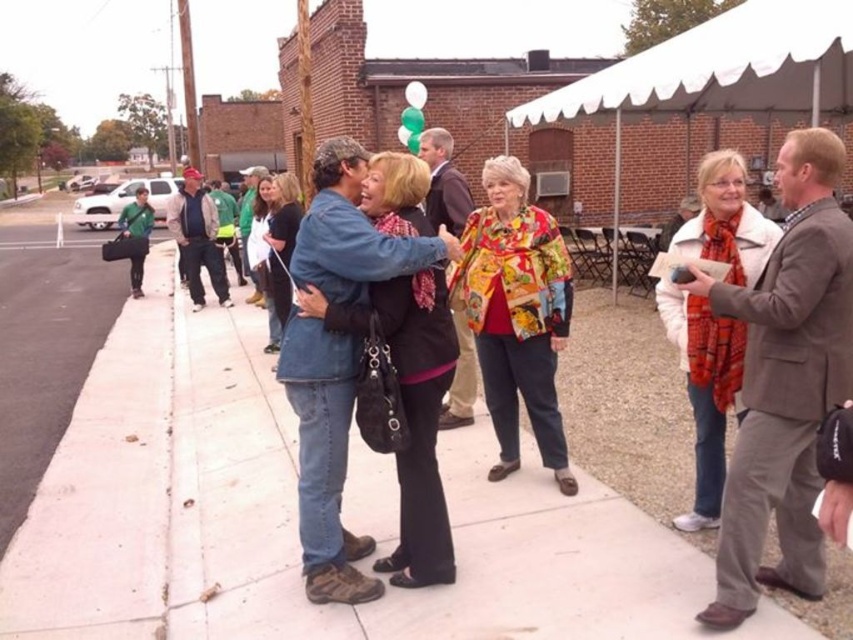
Which is more to the right, orange scarf at center or printed fabric jacket at center?

From the viewer's perspective, orange scarf at center appears more on the right side.

Measure the distance between point [822,301] and camera.

2.57 meters

Locate an element on the screen. This screenshot has height=640, width=853. orange scarf at center is located at coordinates (785, 381).

Who is positioned more to the right, orange scarf at center or green fabric bag at left?

Positioned to the right is orange scarf at center.

Can you confirm if orange scarf at center is positioned below green fabric bag at left?

Yes.

Is point (706, 614) positioned after point (122, 221)?

No, (706, 614) is in front of (122, 221).

The width and height of the screenshot is (853, 640). I want to click on orange scarf at center, so click(x=785, y=381).

Between point (680, 285) and point (614, 163), which one is positioned behind?

Point (614, 163)

Between orange scarf at center and white fabric canopy at upper right, which one has less height?

orange scarf at center is shorter.

Find the location of a particular element. The image size is (853, 640). orange scarf at center is located at coordinates (785, 381).